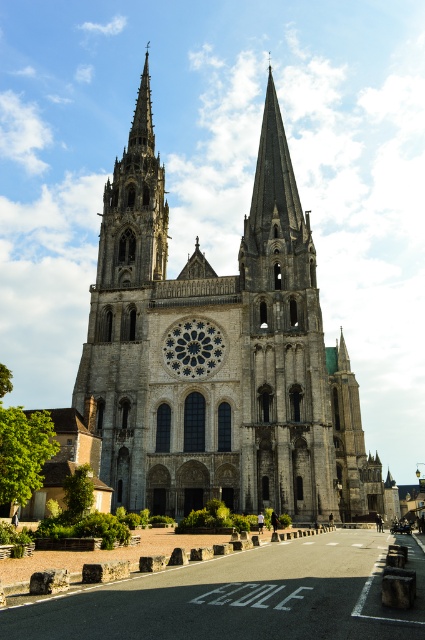
Question: Is gray stone church at center below smooth stone spire at upper left?

Choices:
 (A) no
 (B) yes

Answer: (B)

Question: Can you confirm if gray stone church at center is positioned to the left of smooth stone spire at upper left?

Choices:
 (A) no
 (B) yes

Answer: (A)

Question: Can you confirm if smooth stone spire at upper left is bigger than dark gray stone rose window at center?

Choices:
 (A) yes
 (B) no

Answer: (A)

Question: Among these points, which one is farthest from the camera?

Choices:
 (A) (170, 348)
 (B) (289, 404)

Answer: (A)

Question: Which point is farther to the camera?

Choices:
 (A) dark gray stone rose window at center
 (B) smooth stone spire at upper left

Answer: (B)

Question: Which object is positioned closest to the smooth stone spire at upper left?

Choices:
 (A) dark gray stone rose window at center
 (B) gray stone church at center

Answer: (B)